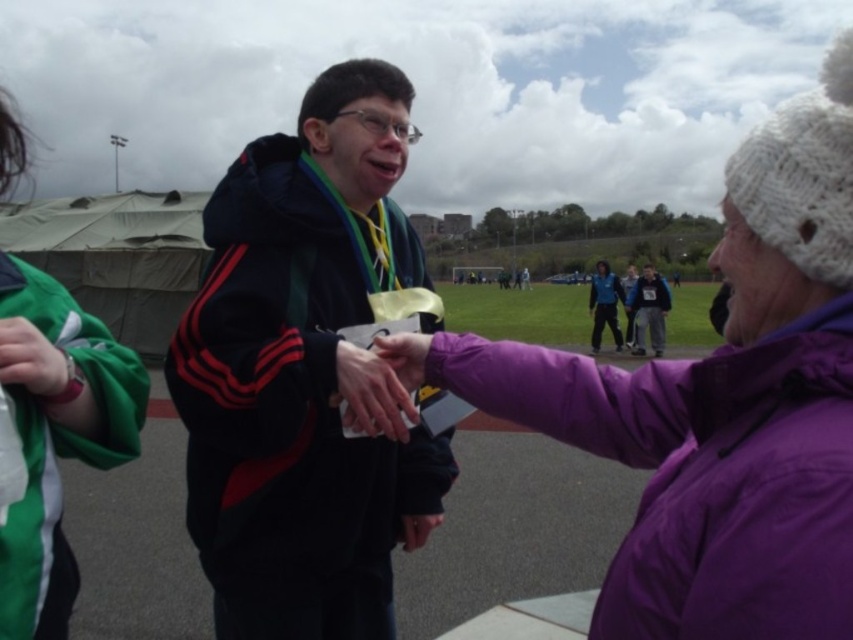
Does purple fleece jacket at center have a lesser height compared to green fabric at left?

Indeed, purple fleece jacket at center has a lesser height compared to green fabric at left.

Between point (631, 451) and point (25, 403), which one is positioned in front?

Point (25, 403) is in front.

Image resolution: width=853 pixels, height=640 pixels. I want to click on purple fleece jacket at center, so click(x=718, y=404).

Is green fabric at left shorter than matte blue jacket at center?

Correct, green fabric at left is not as tall as matte blue jacket at center.

Which of these two, green fabric at left or matte blue jacket at center, stands taller?

Standing taller between the two is matte blue jacket at center.

I want to click on green fabric at left, so click(56, 435).

At what (x,y) coordinates should I click in order to perform the action: click on green fabric at left. Please return your answer as a coordinate pair (x, y). The width and height of the screenshot is (853, 640). Looking at the image, I should click on (56, 435).

Who is higher up, matte black jacket at center or green fabric at left?

green fabric at left is higher up.

Does matte black jacket at center have a smaller size compared to green fabric at left?

No.

Between point (386, 401) and point (45, 449), which one is positioned in front?

Point (45, 449)

You are a GUI agent. You are given a task and a screenshot of the screen. Output one action in this format:
    pyautogui.click(x=<x>, y=<y>)
    Task: Click on the matte black jacket at center
    The height and width of the screenshot is (640, 853).
    Given the screenshot: What is the action you would take?
    [305, 372]